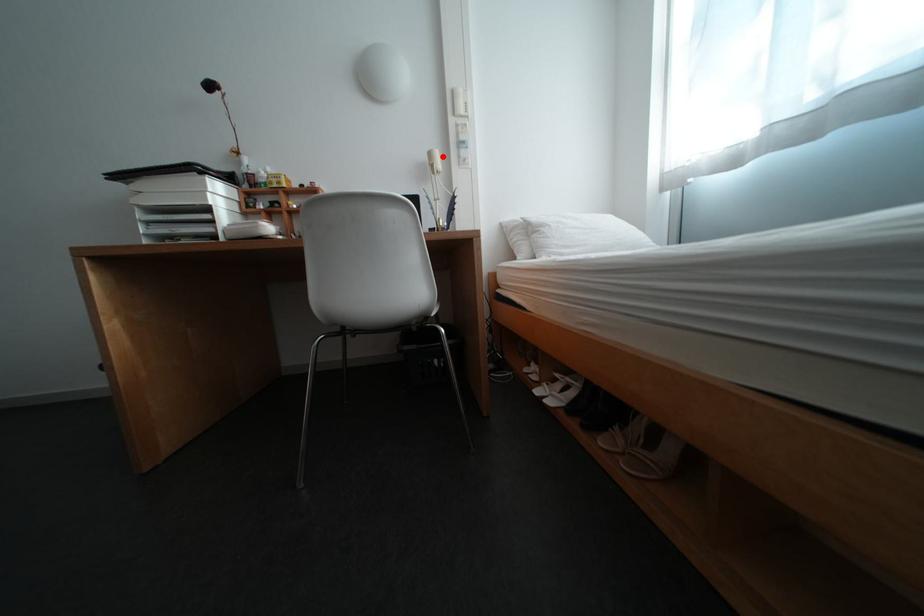
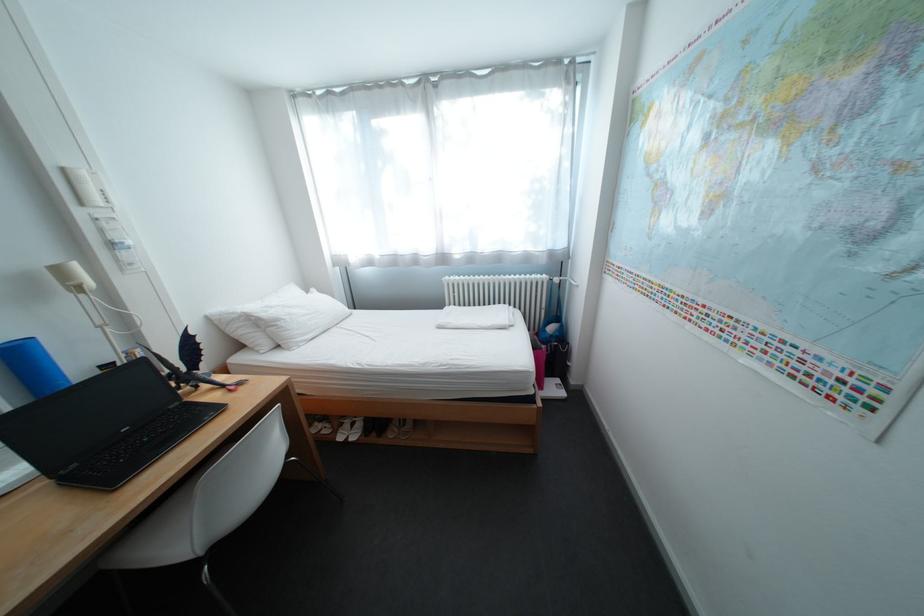
Question: I am providing you with two images of the same scene from different viewpoints. Image1 has a red point marked. In image2, the corresponding 3D location appears at what relative position? Reply with the corresponding letter.

Choices:
 (A) Closer
 (B) Farther

Answer: (B)